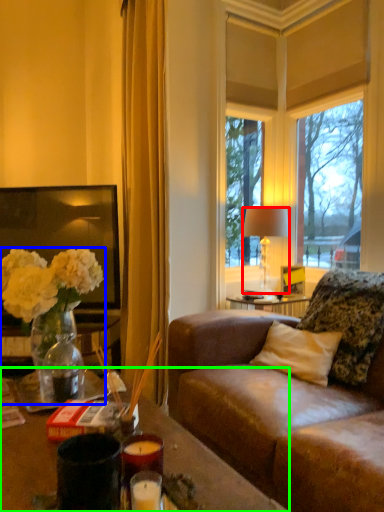
Question: Estimate the real-world distances between objects in this image. Which object is farther from lamp (highlighted by a red box), houseplant (highlighted by a blue box) or desk (highlighted by a green box)?

Choices:
 (A) houseplant
 (B) desk

Answer: (B)